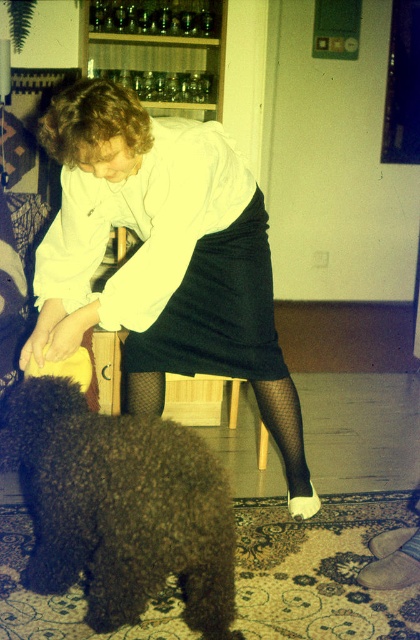
Question: Observing the image, what is the correct spatial positioning of dark brown fur at lower left in reference to gray fabric stocking at lower right?

Choices:
 (A) above
 (B) below

Answer: (A)

Question: Is matte white blouse at center positioned in front of gray fabric stocking at lower right?

Choices:
 (A) yes
 (B) no

Answer: (A)

Question: Which object is closer to the camera taking this photo?

Choices:
 (A) dark brown fur at lower left
 (B) matte white blouse at center
 (C) gray fabric stocking at lower right

Answer: (A)

Question: Which point is closer to the camera taking this photo?

Choices:
 (A) (144, 604)
 (B) (81, 104)

Answer: (B)

Question: Which object is farther from the camera taking this photo?

Choices:
 (A) dark brown fur at lower left
 (B) gray fabric stocking at lower right
 (C) matte white blouse at center

Answer: (B)

Question: Is dark brown fur at lower left to the left of gray fabric stocking at lower right from the viewer's perspective?

Choices:
 (A) yes
 (B) no

Answer: (A)